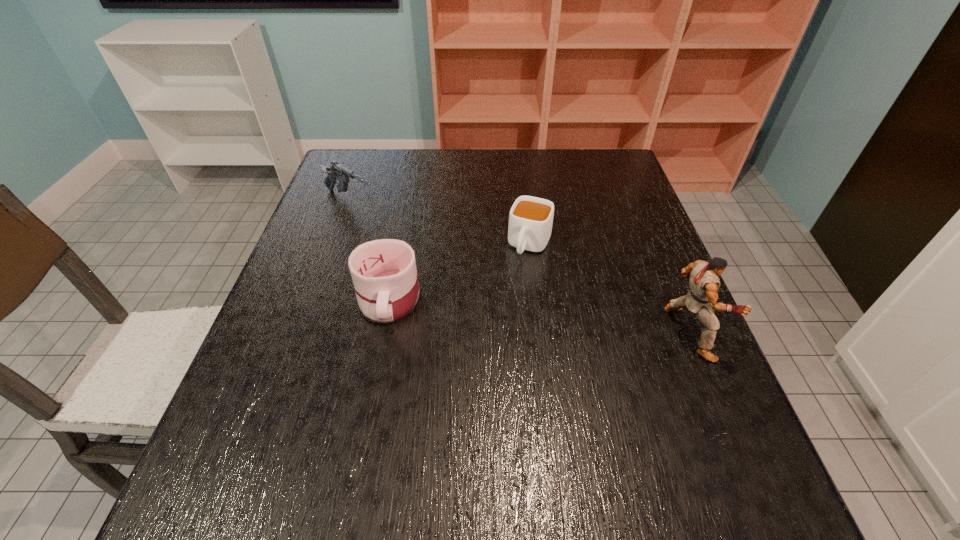
Identify the location of the third object from right to left. This screenshot has height=540, width=960. (384, 273).

Locate an element on the screen. This screenshot has width=960, height=540. the tallest object is located at coordinates (704, 282).

The image size is (960, 540). Find the location of `the rightmost object`. the rightmost object is located at coordinates (704, 282).

Image resolution: width=960 pixels, height=540 pixels. I want to click on gun, so click(335, 171).

Locate an element on the screen. This screenshot has width=960, height=540. the leftmost object is located at coordinates (335, 171).

Where is `the third object from left to right`? The height and width of the screenshot is (540, 960). the third object from left to right is located at coordinates (530, 220).

This screenshot has width=960, height=540. Find the location of `cup`. cup is located at coordinates (530, 220).

I want to click on vacant region located 0.120m on the side with the handle of the mug, so pos(372,384).

Image resolution: width=960 pixels, height=540 pixels. I want to click on free space located at the barrel of the gun, so click(447, 260).

You are a GUI agent. You are given a task and a screenshot of the screen. Output one action in this format:
    pyautogui.click(x=<x>, y=<y>)
    Task: Click on the vacant region located 0.230m at the barrel of the gun
    The height and width of the screenshot is (540, 960).
    Given the screenshot: What is the action you would take?
    (x=430, y=249)